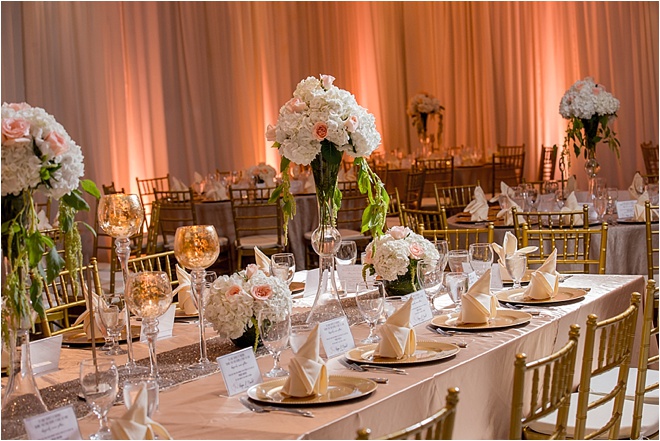
Where is `chairs of front table`? Image resolution: width=660 pixels, height=441 pixels. chairs of front table is located at coordinates (606, 335), (550, 365), (449, 423), (651, 316), (604, 253), (457, 232), (144, 258), (73, 300).